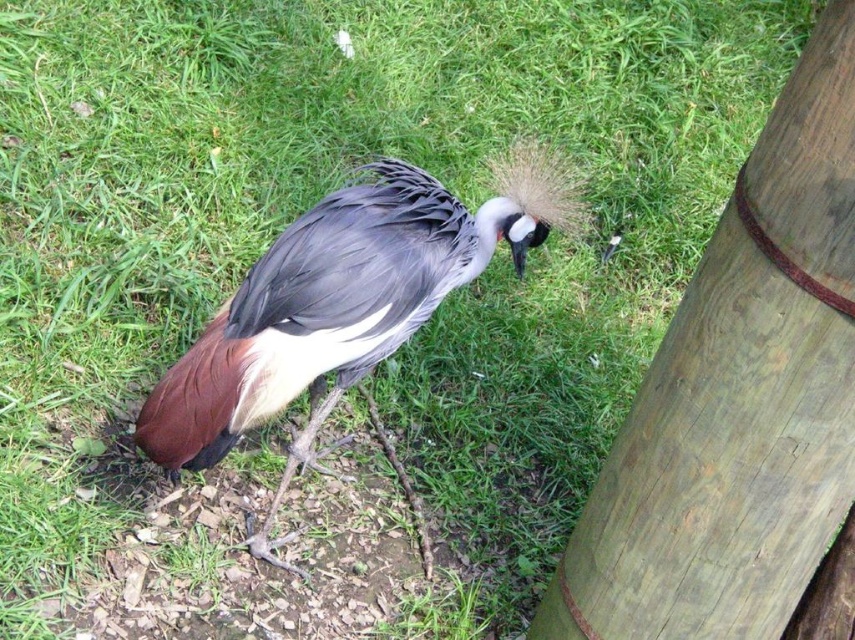
Question: Is wooden pole at right positioned before brown feathered bird at center?

Choices:
 (A) yes
 (B) no

Answer: (A)

Question: Which point is closer to the camera taking this photo?

Choices:
 (A) (779, 186)
 (B) (254, 396)

Answer: (A)

Question: Considering the relative positions of wooden pole at right and brown feathered bird at center in the image provided, where is wooden pole at right located with respect to brown feathered bird at center?

Choices:
 (A) above
 (B) below

Answer: (B)

Question: Can you confirm if wooden pole at right is bigger than brown feathered bird at center?

Choices:
 (A) no
 (B) yes

Answer: (A)